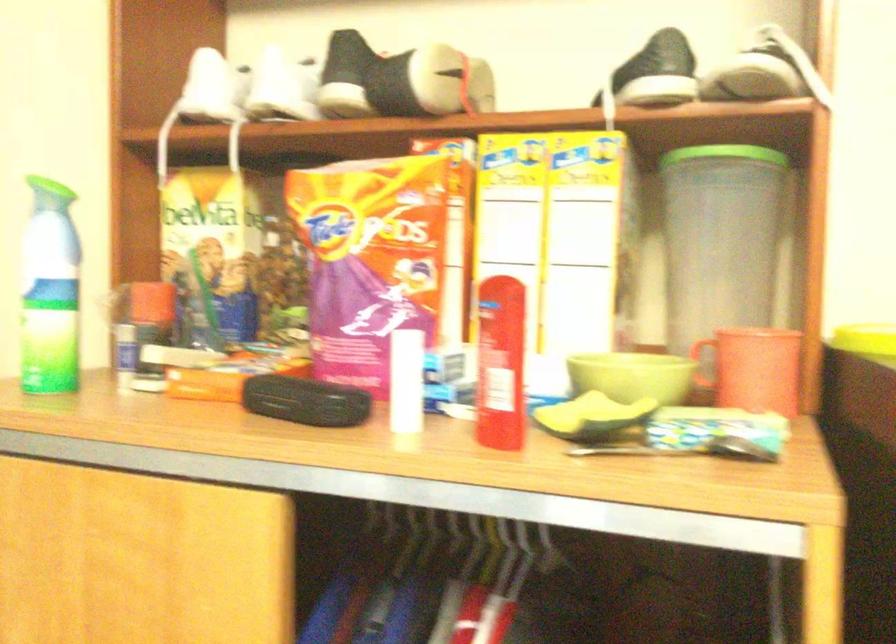
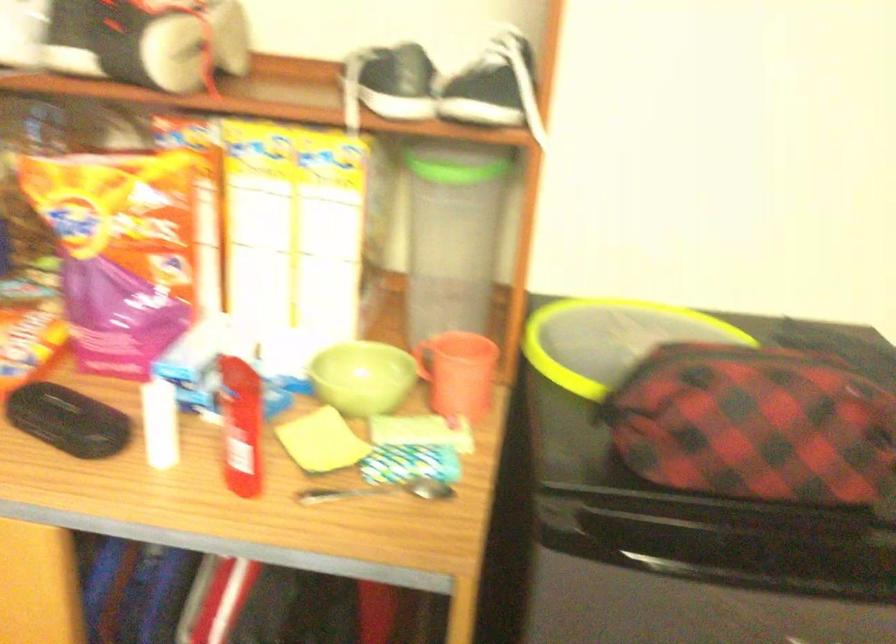
Question: Based on the continuous images, in which direction is the camera rotating? Reply with the corresponding letter.

Choices:
 (A) Left
 (B) Right
 (C) Up
 (D) Down

Answer: (D)